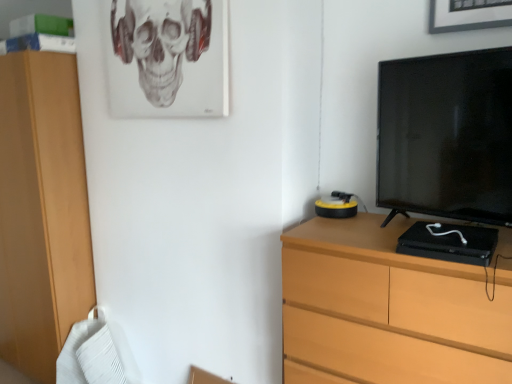
What do you see at coordinates (446, 136) in the screenshot? I see `black glossy television at right` at bounding box center [446, 136].

Where is `black glossy television at right`? The height and width of the screenshot is (384, 512). black glossy television at right is located at coordinates (446, 136).

From the image's perspective, is wooden chest of drawers at right located above or below black glossy television at right?

wooden chest of drawers at right is below black glossy television at right.

Is point (306, 377) positioned after point (490, 163)?

Yes, it is behind point (490, 163).

You are a GUI agent. You are given a task and a screenshot of the screen. Output one action in this format:
    pyautogui.click(x=<x>, y=<y>)
    Task: Click on the television above the wooden chest of drawers at right (from the image's perspective)
    
    Given the screenshot: What is the action you would take?
    pyautogui.click(x=446, y=136)

Is wooden chest of drawers at right surrounding black glossy television at right?

That's incorrect, black glossy television at right is not inside wooden chest of drawers at right.

Is point (401, 284) farther from viewer compared to point (176, 34)?

No, it is not.

Locate an element on the screen. The height and width of the screenshot is (384, 512). chest of drawers located on the right of gray matte skull at upper center is located at coordinates (388, 309).

From a real-world perspective, which object stands above the other?

gray matte skull at upper center, from a real-world perspective.

From the image's perspective, is wooden chest of drawers at right below gray matte skull at upper center?

Yes, from the image's perspective, wooden chest of drawers at right is below gray matte skull at upper center.

What's the angular difference between black glossy television at right and gray matte skull at upper center's facing directions?

The facing directions of black glossy television at right and gray matte skull at upper center are 13.8 degrees apart.

Considering the sizes of objects black glossy television at right and gray matte skull at upper center in the image provided, who is wider, black glossy television at right or gray matte skull at upper center?

With larger width is black glossy television at right.

From a real-world perspective, is black glossy television at right positioned under gray matte skull at upper center based on gravity?

Yes, from a real-world perspective, black glossy television at right is under gray matte skull at upper center.

Considering the relative positions of gray matte skull at upper center and wooden chest of drawers at right in the image provided, is gray matte skull at upper center to the left of wooden chest of drawers at right from the viewer's perspective?

Correct, you'll find gray matte skull at upper center to the left of wooden chest of drawers at right.

The width and height of the screenshot is (512, 384). In order to click on chest of drawers on the right of the gray matte skull at upper center in this screenshot , I will do `click(388, 309)`.

Is gray matte skull at upper center spatially inside wooden chest of drawers at right, or outside of it?

gray matte skull at upper center lies outside wooden chest of drawers at right.

Considering the relative sizes of gray matte skull at upper center and wooden chest of drawers at right in the image provided, is gray matte skull at upper center thinner than wooden chest of drawers at right?

Indeed, gray matte skull at upper center has a lesser width compared to wooden chest of drawers at right.

From a real-world perspective, between gray matte skull at upper center and black glossy television at right, who is vertically lower?

black glossy television at right, from a real-world perspective.

Does gray matte skull at upper center come in front of black glossy television at right?

That is False.

Could you tell me if gray matte skull at upper center is facing black glossy television at right?

No, gray matte skull at upper center is not facing towards black glossy television at right.

Does point (201, 45) appear closer or farther from the camera than point (508, 51)?

Point (201, 45) is positioned farther from the camera compared to point (508, 51).

Is black glossy television at right surrounding wooden chest of drawers at right?

No, wooden chest of drawers at right is not surrounded by black glossy television at right.

Are black glossy television at right and wooden chest of drawers at right located far from each other?

That's not correct — black glossy television at right is a little close to wooden chest of drawers at right.

Between black glossy television at right and wooden chest of drawers at right, which one appears on the right side from the viewer's perspective?

Positioned to the right is black glossy television at right.

Locate an element on the screen. The height and width of the screenshot is (384, 512). the chest of drawers in front of the black glossy television at right is located at coordinates (388, 309).

The width and height of the screenshot is (512, 384). There is a wooden chest of drawers at right. In order to click on skull above it (from a real-world perspective) in this screenshot , I will do `click(161, 42)`.

Based on the photo, which object lies further to the anchor point gray matte skull at upper center, wooden chest of drawers at right or black glossy television at right?

Among the two, wooden chest of drawers at right is located further to gray matte skull at upper center.

Looking at the image, which one is located closer to black glossy television at right, gray matte skull at upper center or wooden chest of drawers at right?

wooden chest of drawers at right is closer to black glossy television at right.

When comparing their distances from gray matte skull at upper center, does black glossy television at right or wooden chest of drawers at right seem further?

wooden chest of drawers at right is further to gray matte skull at upper center.

When comparing their distances from black glossy television at right, does wooden chest of drawers at right or gray matte skull at upper center seem further?

gray matte skull at upper center is positioned further to the anchor black glossy television at right.

Looking at the image, which one is located closer to wooden chest of drawers at right, gray matte skull at upper center or black glossy television at right?

Based on the image, black glossy television at right appears to be nearer to wooden chest of drawers at right.

Estimate the real-world distances between objects in this image. Which object is further from wooden chest of drawers at right, black glossy television at right or gray matte skull at upper center?

gray matte skull at upper center lies further to wooden chest of drawers at right than the other object.

Locate an element on the screen. The width and height of the screenshot is (512, 384). television between gray matte skull at upper center and wooden chest of drawers at right in the vertical direction is located at coordinates (446, 136).